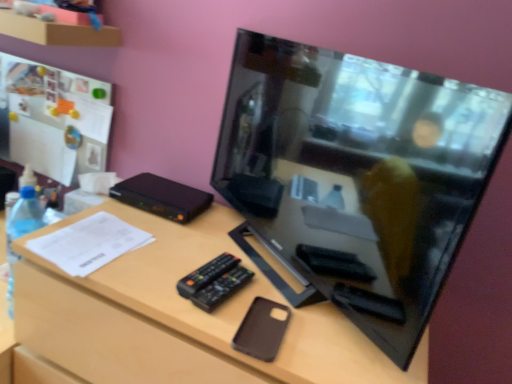
Where is `vacant space in front of black plastic remote at center`? vacant space in front of black plastic remote at center is located at coordinates (204, 311).